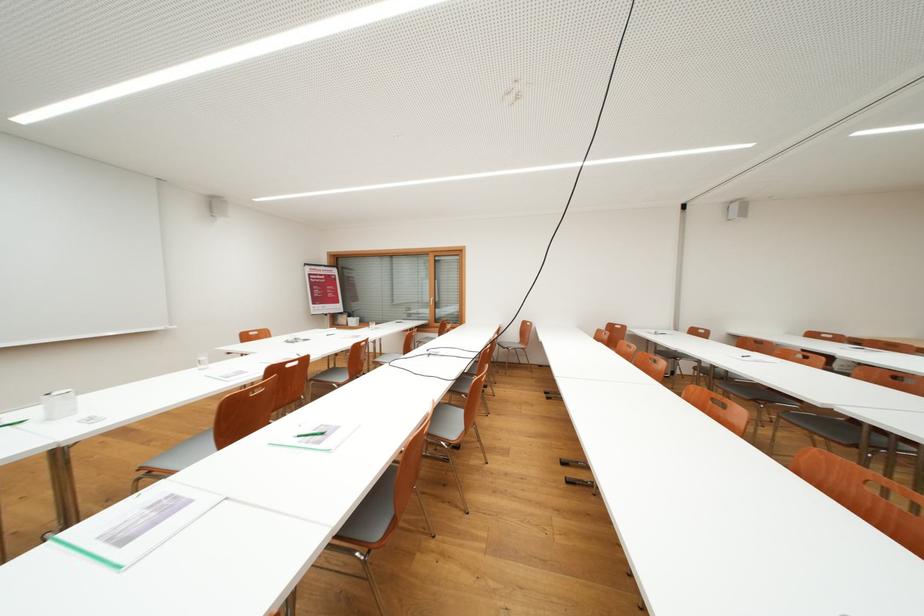
Where is `green pen`? Image resolution: width=924 pixels, height=616 pixels. green pen is located at coordinates (300, 437).